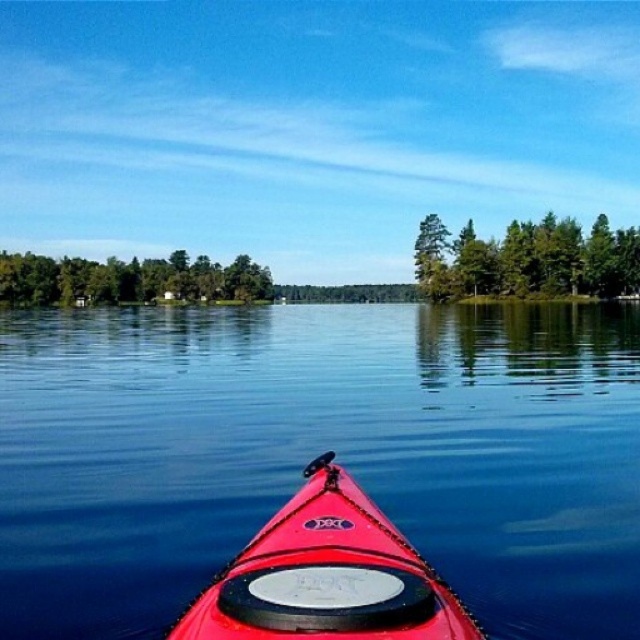
You are in a red kayak and want to know if the transparent blue water at center is larger or smaller than the green leafy trees at center. Based on the scene, what can you observe?

The transparent blue water at center is smaller than the green leafy trees at center.

You are sitting in the red kayak facing the water. You notice two points marked in the scene. From your perspective, which point is closer to you? The points are labeled as point 1 at coordinates point (168, 396) and point 2 at coordinates point (173, 292).

Point 1 at coordinates point (168, 396) is in front of point 2 at coordinates point (173, 292), so from your perspective in the kayak, point 1 is closer to you.

You are a photographer trying to capture the shiny red kayak at center from a drone. The drone is currently hovering at point (326, 577). What should you do to get a clear shot of the kayak?

The point (326, 577) marks the shiny red kayak at center, so you should adjust the drone to hover directly above this point to capture the kayak clearly.